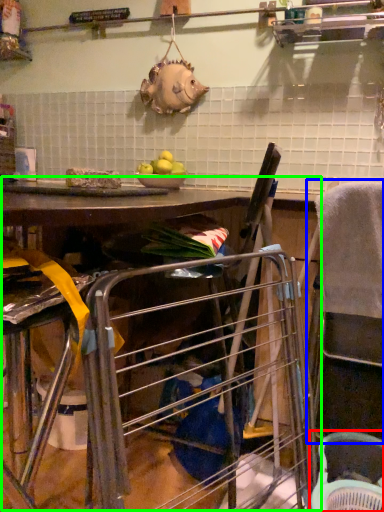
Question: Considering the real-world distances, which object is closest to basket (highlighted by a red box)? feeding chair (highlighted by a blue box) or workbench (highlighted by a green box).

Choices:
 (A) feeding chair
 (B) workbench

Answer: (A)